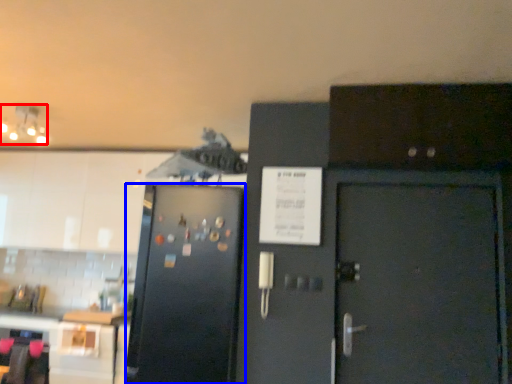
Question: Among these objects, which one is farthest to the camera, lamp (highlighted by a red box) or refrigerator (highlighted by a blue box)?

Choices:
 (A) lamp
 (B) refrigerator

Answer: (A)